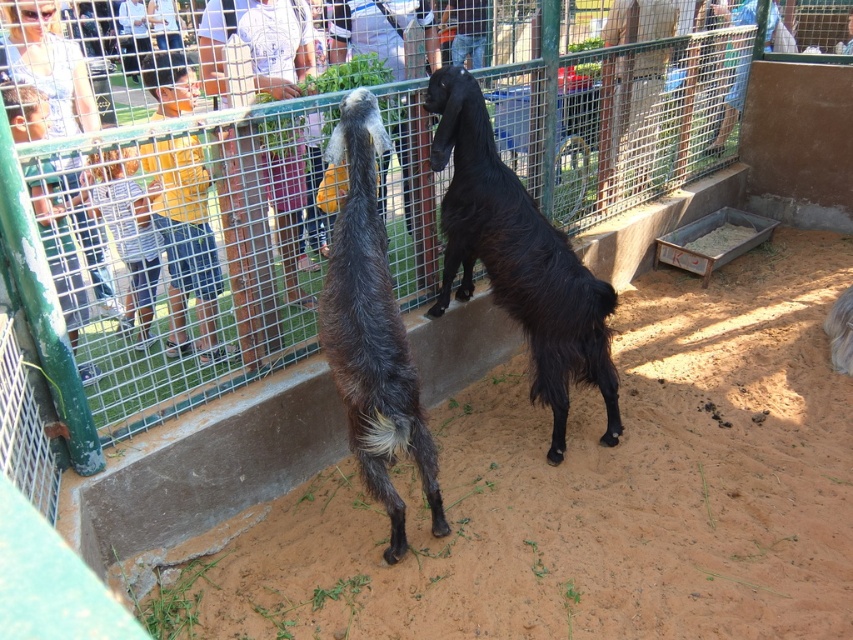
Question: Which of the following is the closest to the observer?

Choices:
 (A) dark brown fur goat at center
 (B) black shaggy goat at center
 (C) brown sandy dirt at center

Answer: (C)

Question: Considering the relative positions of brown sandy dirt at center and dark brown fur goat at center in the image provided, where is brown sandy dirt at center located with respect to dark brown fur goat at center?

Choices:
 (A) above
 (B) below

Answer: (B)

Question: Is black shaggy goat at center positioned in front of dark brown fur goat at center?

Choices:
 (A) yes
 (B) no

Answer: (B)

Question: Among these points, which one is farthest from the camera?

Choices:
 (A) (498, 570)
 (B) (502, 278)

Answer: (B)

Question: Which of these objects is positioned farthest from the dark brown fur goat at center?

Choices:
 (A) black shaggy goat at center
 (B) brown sandy dirt at center

Answer: (B)

Question: Is black shaggy goat at center bigger than dark brown fur goat at center?

Choices:
 (A) no
 (B) yes

Answer: (B)